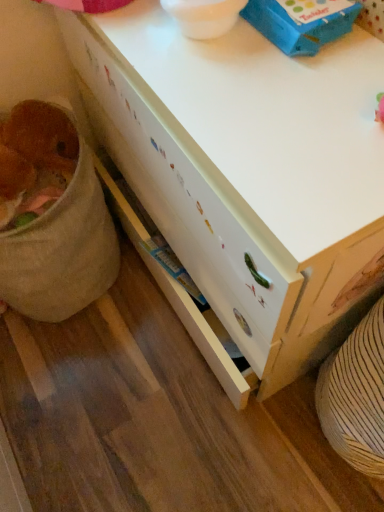
Question: Is white wood desk at center to the left of fuzzy brown stuffed animal at lower left from the viewer's perspective?

Choices:
 (A) yes
 (B) no

Answer: (B)

Question: Is the position of white wood desk at center more distant than that of fuzzy brown stuffed animal at lower left?

Choices:
 (A) no
 (B) yes

Answer: (A)

Question: Is white wood desk at center bigger than fuzzy brown stuffed animal at lower left?

Choices:
 (A) yes
 (B) no

Answer: (A)

Question: Is white wood desk at center taller than fuzzy brown stuffed animal at lower left?

Choices:
 (A) no
 (B) yes

Answer: (B)

Question: Is white wood desk at center oriented towards fuzzy brown stuffed animal at lower left?

Choices:
 (A) no
 (B) yes

Answer: (B)

Question: Considering the positions of white wood desk at center and blue cardboard box at upper center in the image, is white wood desk at center taller or shorter than blue cardboard box at upper center?

Choices:
 (A) tall
 (B) short

Answer: (A)

Question: Looking at their shapes, would you say white wood desk at center is wider or thinner than blue cardboard box at upper center?

Choices:
 (A) thin
 (B) wide

Answer: (B)

Question: In the image, is white wood desk at center on the left side or the right side of blue cardboard box at upper center?

Choices:
 (A) left
 (B) right

Answer: (A)

Question: Considering the positions of point (97, 49) and point (258, 4), is point (97, 49) closer or farther from the camera than point (258, 4)?

Choices:
 (A) farther
 (B) closer

Answer: (A)

Question: In the image, is blue cardboard box at upper center on the left side or the right side of white wood desk at center?

Choices:
 (A) left
 (B) right

Answer: (B)

Question: Considering the positions of blue cardboard box at upper center and white wood desk at center in the image, is blue cardboard box at upper center wider or thinner than white wood desk at center?

Choices:
 (A) thin
 (B) wide

Answer: (A)

Question: From the image's perspective, is blue cardboard box at upper center located above or below white wood desk at center?

Choices:
 (A) below
 (B) above

Answer: (B)

Question: Considering their positions, is blue cardboard box at upper center located in front of or behind white wood desk at center?

Choices:
 (A) behind
 (B) front

Answer: (A)

Question: From the image's perspective, is fuzzy brown stuffed animal at lower left above or below white wood desk at center?

Choices:
 (A) below
 (B) above

Answer: (A)

Question: Considering their positions, is fuzzy brown stuffed animal at lower left located in front of or behind white wood desk at center?

Choices:
 (A) front
 (B) behind

Answer: (B)